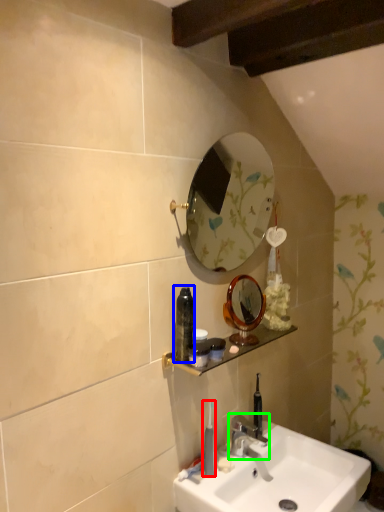
Question: Which object is the farthest from toothbrush (highlighted by a red box)? Choose among these: mouthwash (highlighted by a blue box) or tap (highlighted by a green box).

Choices:
 (A) mouthwash
 (B) tap

Answer: (A)